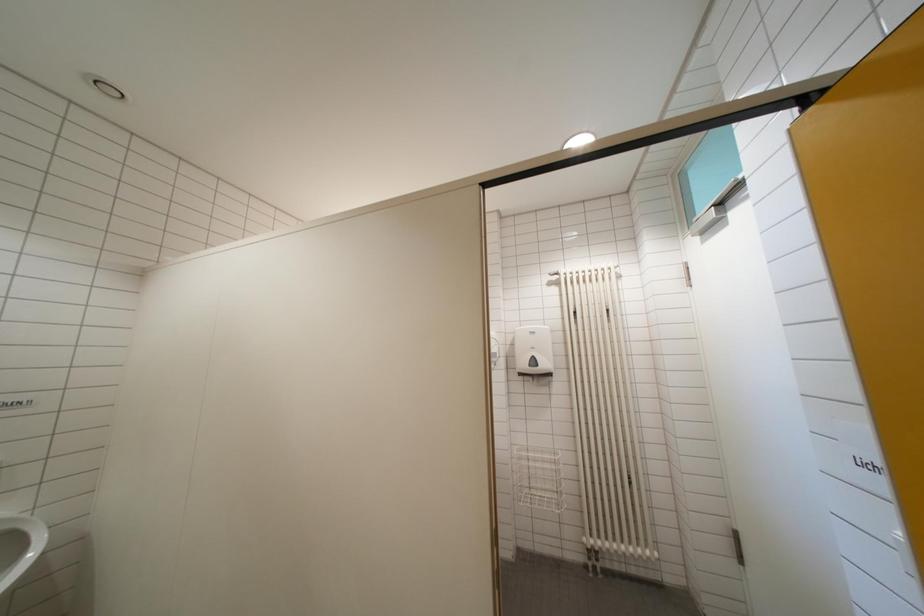
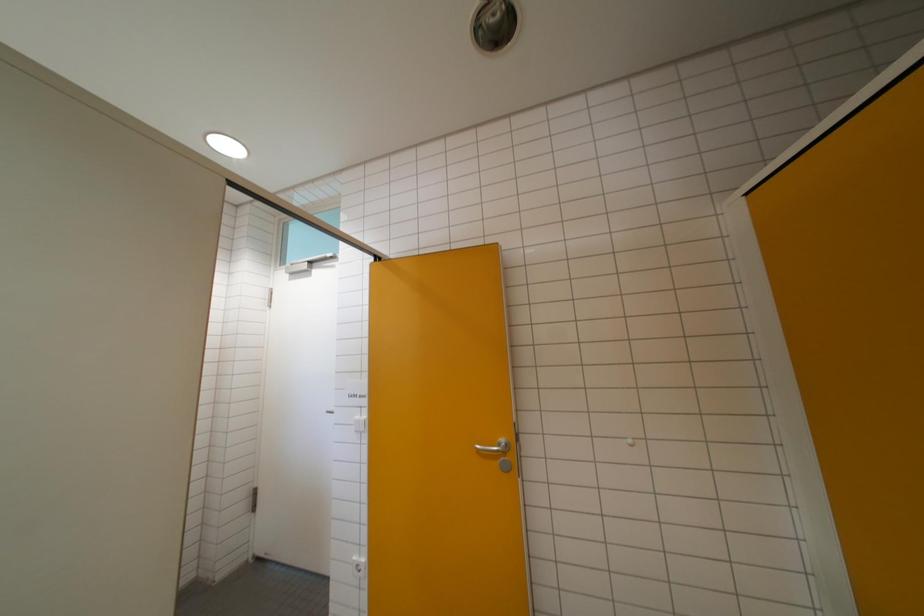
Question: The first image is from the beginning of the video and the second image is from the end. How did the camera likely rotate when shooting the video?

Choices:
 (A) Left
 (B) Right
 (C) Up
 (D) Down

Answer: (B)